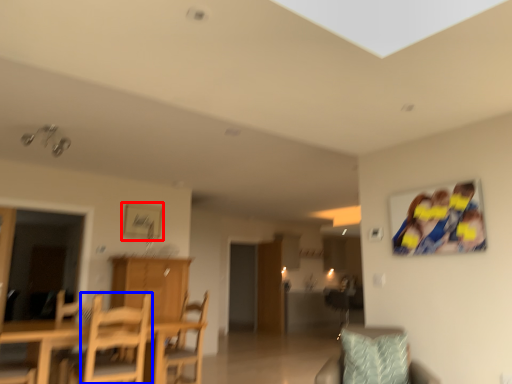
Question: Which of the following is the closest to the observer, picture frame (highlighted by a red box) or chair (highlighted by a blue box)?

Choices:
 (A) picture frame
 (B) chair

Answer: (B)